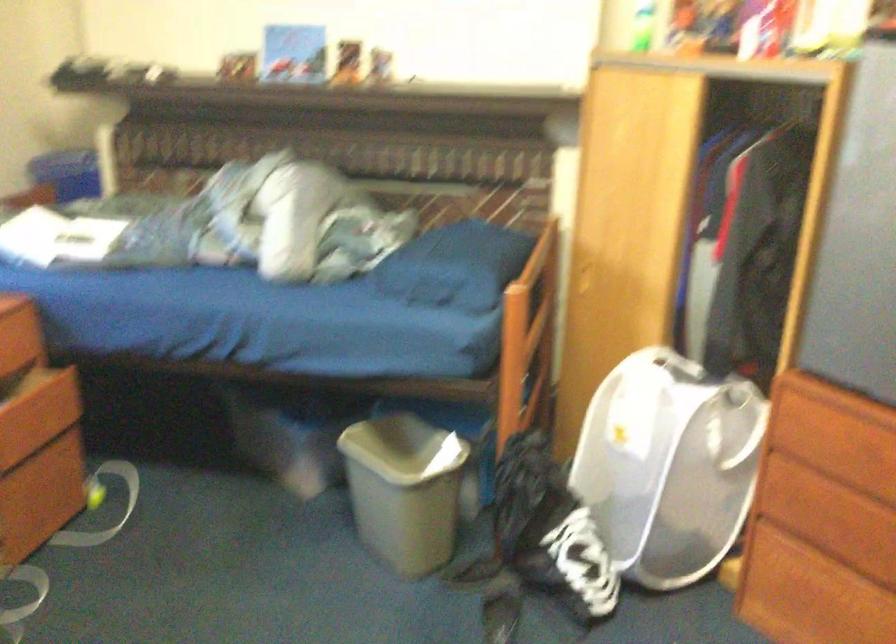
The location [549,529] corresponds to which object?

It corresponds to the black and white bag in the image.